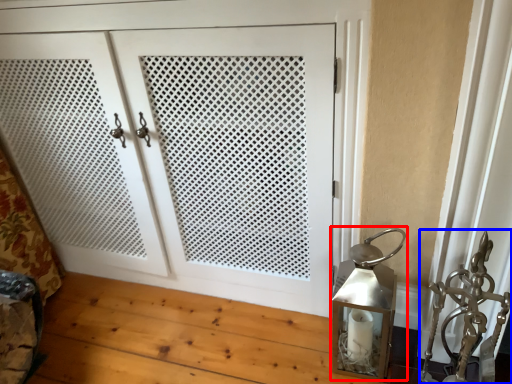
Question: Which of the following is the farthest to the observer, table lamp (highlighted by a red box) or sculpture (highlighted by a blue box)?

Choices:
 (A) table lamp
 (B) sculpture

Answer: (A)